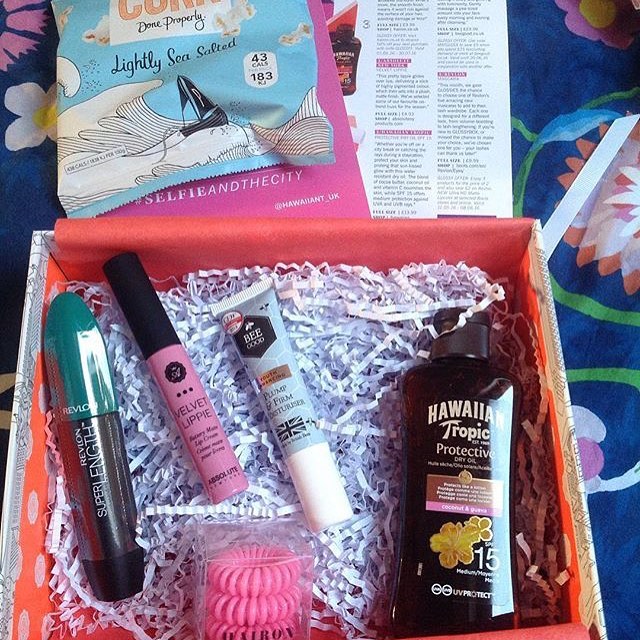
The image size is (640, 640). I want to click on pink curled cable, so click(259, 617).